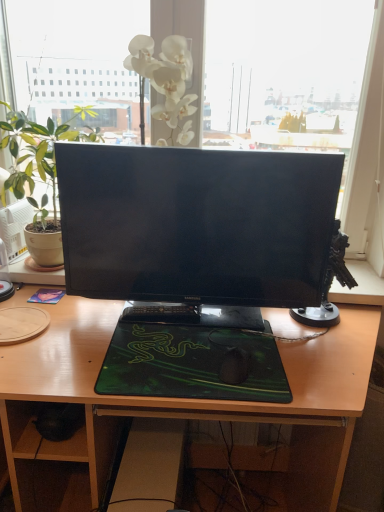
This screenshot has width=384, height=512. In order to click on vacant space behind black matte mouse at center in this screenshot , I will do `click(238, 333)`.